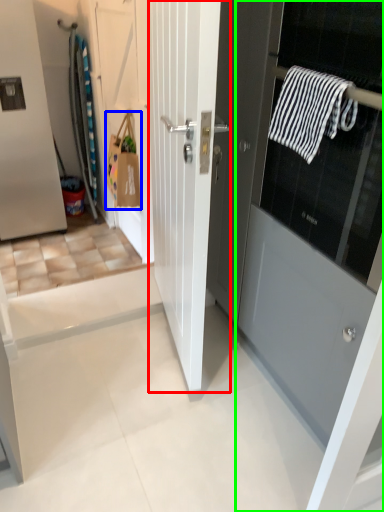
Question: Estimate the real-world distances between objects in this image. Which object is farther from door (highlighted by a red box), shopping bag (highlighted by a blue box) or door (highlighted by a green box)?

Choices:
 (A) shopping bag
 (B) door

Answer: (A)